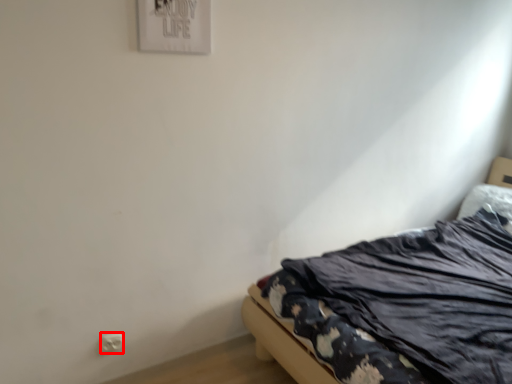
Question: Observing the image, what is the correct spatial positioning of electric outlet (annotated by the red box) in reference to bed?

Choices:
 (A) left
 (B) right

Answer: (A)